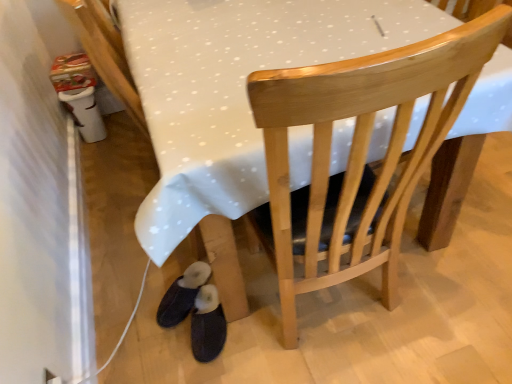
The height and width of the screenshot is (384, 512). I want to click on free space in front of black suede slippers at lower left, which appears as the 2th footwear when viewed from the right, so click(175, 353).